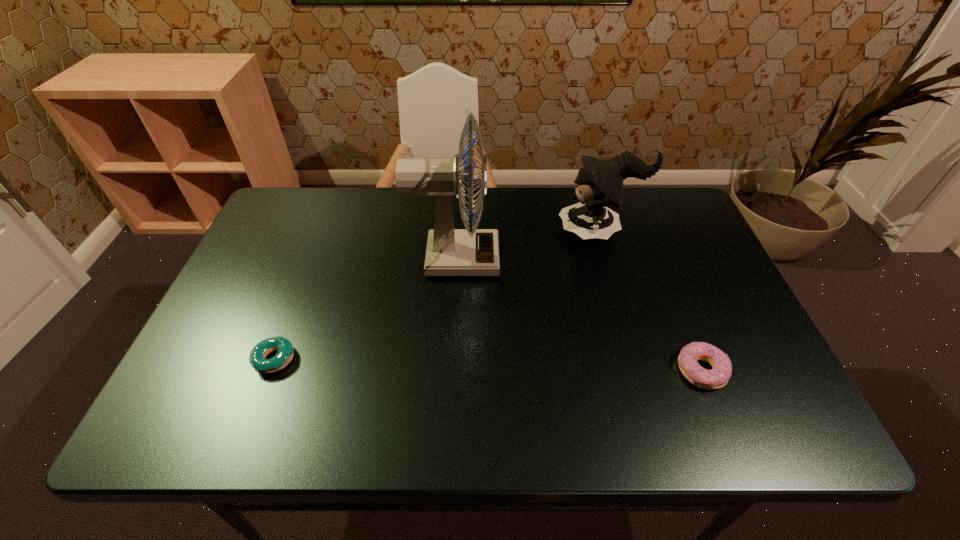
This screenshot has height=540, width=960. I want to click on vacant area that lies between the tallest object and the shorter doughnut, so click(365, 309).

The height and width of the screenshot is (540, 960). I want to click on empty space that is in between the shortest object and the taller doughnut, so click(x=489, y=365).

I want to click on the closest object relative to the shortest object, so click(450, 252).

The height and width of the screenshot is (540, 960). I want to click on object that is the second nearest to the doll, so click(x=716, y=378).

I want to click on free spot that satisfies the following two spatial constraints: 1. on the back side of the taller doughnut; 2. on the front-facing side of the second object from left to right, so click(x=657, y=259).

Locate an element on the screen. The width and height of the screenshot is (960, 540). free location that satisfies the following two spatial constraints: 1. at the face of the third shortest object; 2. on the back side of the second shortest object is located at coordinates [640, 370].

Locate an element on the screen. free region that satisfies the following two spatial constraints: 1. at the face of the second shortest object; 2. on the left side of the doll is located at coordinates (640, 370).

Where is `vacant area that satisfies the following two spatial constraints: 1. on the back side of the right doughnut; 2. at the face of the doll`? vacant area that satisfies the following two spatial constraints: 1. on the back side of the right doughnut; 2. at the face of the doll is located at coordinates (645, 231).

Where is `free location that satisfies the following two spatial constraints: 1. at the face of the taller doughnut; 2. on the left side of the doll`? This screenshot has width=960, height=540. free location that satisfies the following two spatial constraints: 1. at the face of the taller doughnut; 2. on the left side of the doll is located at coordinates (640, 370).

The height and width of the screenshot is (540, 960). What are the coordinates of `vacant area in the image that satisfies the following two spatial constraints: 1. at the face of the taller doughnut; 2. on the left side of the third shortest object` in the screenshot? It's located at (640, 370).